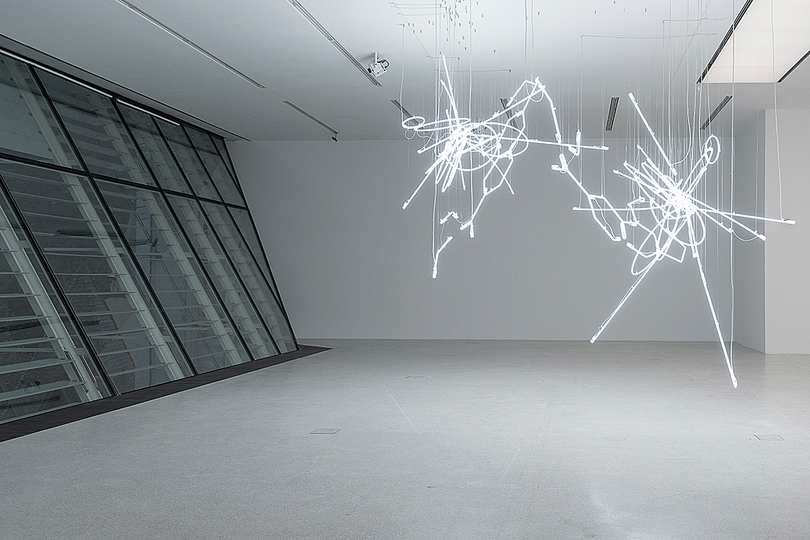
This screenshot has width=810, height=540. In order to click on window shutter blinds in this screenshot , I will do tap(24, 364), tap(121, 352), tap(198, 340), tap(243, 316), tap(266, 310).